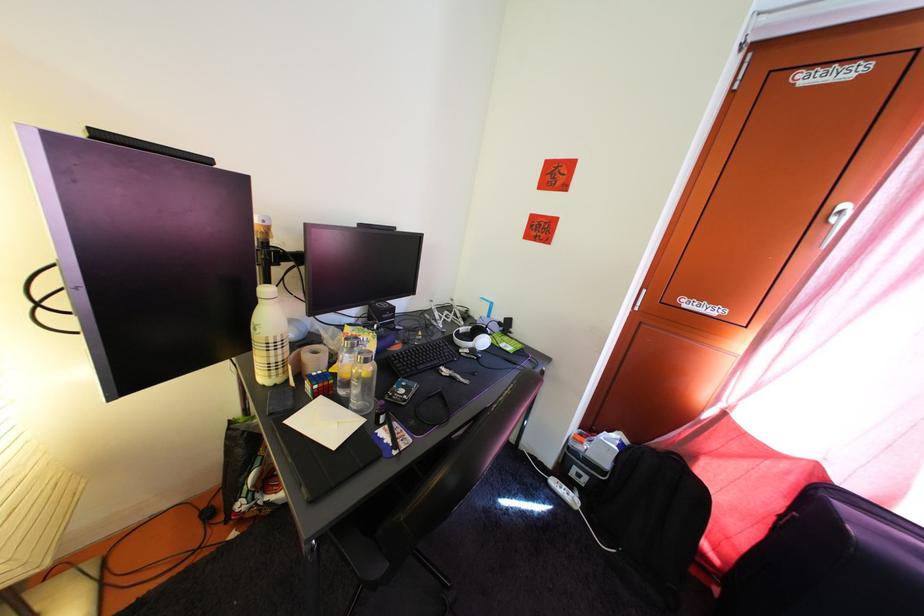
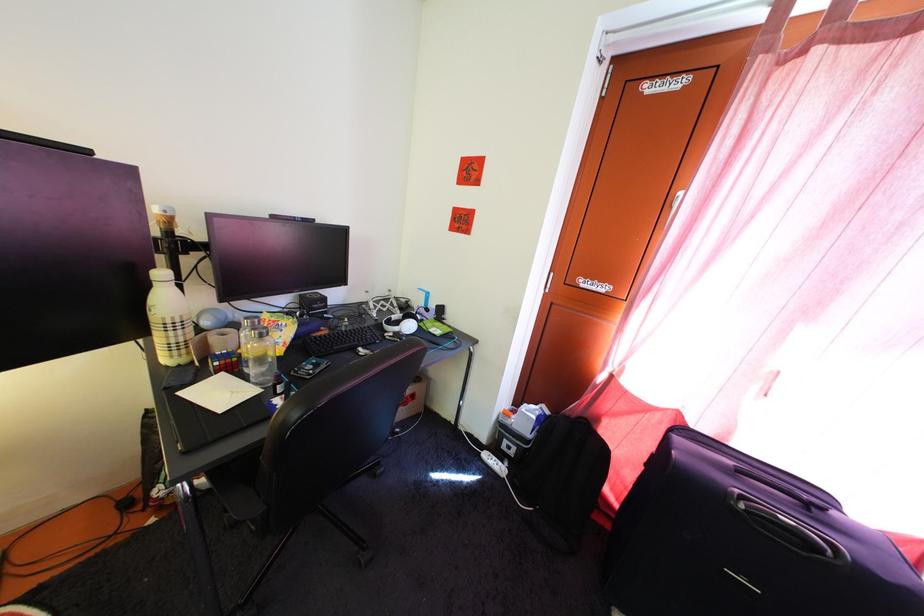
In the second image, find the point that corresponds to pixel 323 361 in the first image.

(233, 342)